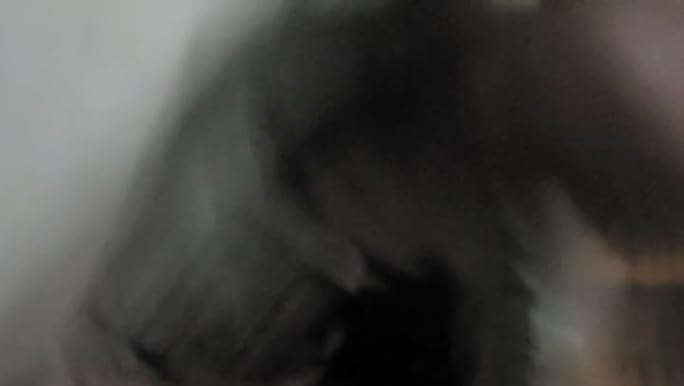
I want to click on corner, so click(x=16, y=16).